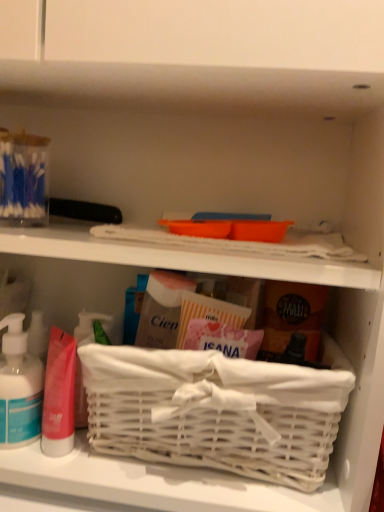
Question: Should I look upward or downward to see translucent plastic pump bottle at lower left?

Choices:
 (A) down
 (B) up

Answer: (A)

Question: From a real-world perspective, does translucent plastic pump bottle at lower left stand above white wicker basket at center?

Choices:
 (A) no
 (B) yes

Answer: (B)

Question: Can you confirm if translucent plastic pump bottle at lower left is wider than white wicker basket at center?

Choices:
 (A) no
 (B) yes

Answer: (A)

Question: Is translucent plastic pump bottle at lower left smaller than white wicker basket at center?

Choices:
 (A) yes
 (B) no

Answer: (A)

Question: Is translucent plastic pump bottle at lower left located outside white wicker basket at center?

Choices:
 (A) yes
 (B) no

Answer: (A)

Question: Considering the relative sizes of translucent plastic pump bottle at lower left and white wicker basket at center in the image provided, is translucent plastic pump bottle at lower left taller than white wicker basket at center?

Choices:
 (A) no
 (B) yes

Answer: (A)

Question: Is the position of translucent plastic pump bottle at lower left more distant than that of white wicker basket at center?

Choices:
 (A) no
 (B) yes

Answer: (B)

Question: Can you confirm if white wicker basket at center is shorter than translucent plastic pump bottle at lower left?

Choices:
 (A) yes
 (B) no

Answer: (B)

Question: Is white wicker basket at center smaller than translucent plastic pump bottle at lower left?

Choices:
 (A) no
 (B) yes

Answer: (A)

Question: From a real-world perspective, is white wicker basket at center under translucent plastic pump bottle at lower left?

Choices:
 (A) no
 (B) yes

Answer: (B)

Question: Are white wicker basket at center and translucent plastic pump bottle at lower left far apart?

Choices:
 (A) yes
 (B) no

Answer: (B)

Question: Is translucent plastic pump bottle at lower left inside white wicker basket at center?

Choices:
 (A) yes
 (B) no

Answer: (B)

Question: From the image's perspective, would you say white wicker basket at center is shown under translucent plastic pump bottle at lower left?

Choices:
 (A) no
 (B) yes

Answer: (B)

Question: From their relative heights in the image, would you say white wicker basket at center is taller or shorter than translucent plastic pump bottle at lower left?

Choices:
 (A) short
 (B) tall

Answer: (B)